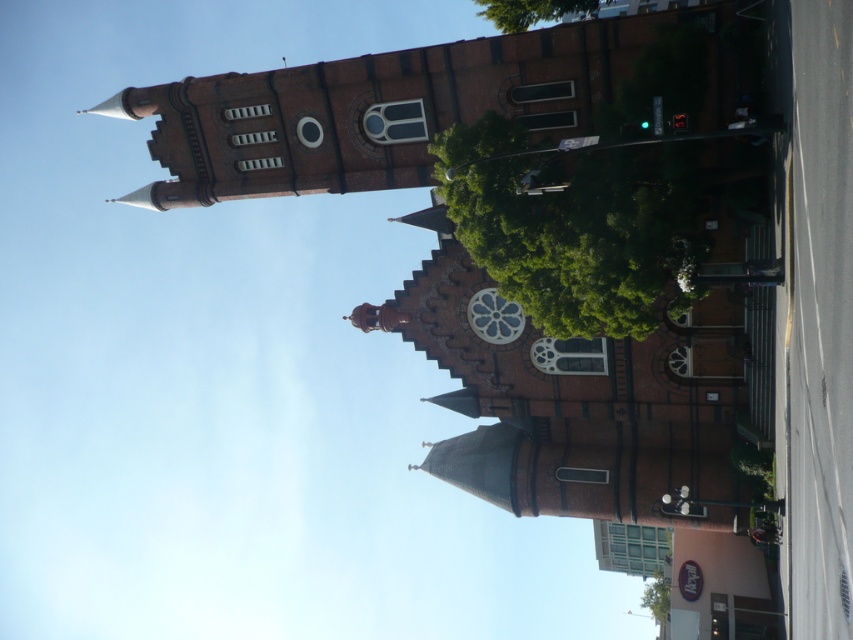
Question: Which point appears closest to the camera in this image?

Choices:
 (A) (488, 301)
 (B) (538, 1)
 (C) (659, 618)
 (D) (341, 77)

Answer: (D)

Question: Which of these objects is positioned farthest from the matte glass clock at center?

Choices:
 (A) green leafy tree at lower right
 (B) green leafy tree at upper center

Answer: (A)

Question: Does green leafy tree at upper center appear over green leafy tree at lower right?

Choices:
 (A) yes
 (B) no

Answer: (A)

Question: Based on their relative distances, which object is nearer to the brick bell tower at upper left?

Choices:
 (A) matte glass clock at center
 (B) green leafy tree at upper center
 (C) green leafy tree at center

Answer: (C)

Question: Can you confirm if brick bell tower at upper left is bigger than matte glass clock at center?

Choices:
 (A) yes
 (B) no

Answer: (A)

Question: Is matte glass clock at center positioned behind green leafy tree at lower right?

Choices:
 (A) no
 (B) yes

Answer: (A)